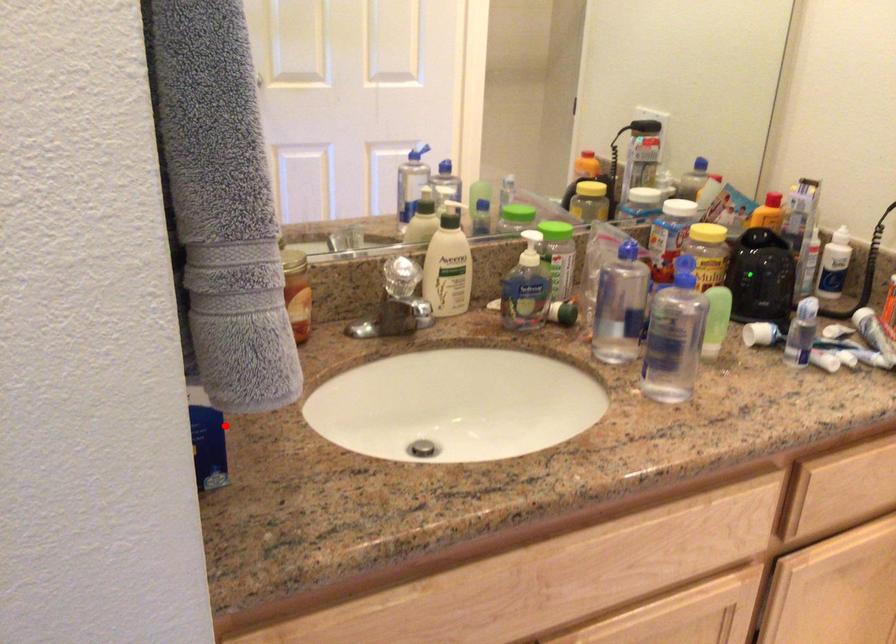
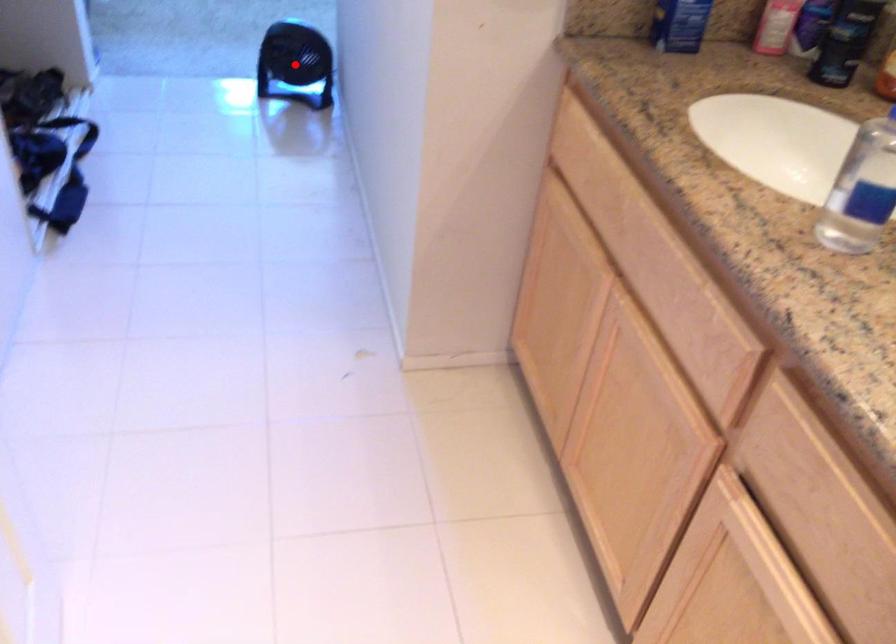
I am providing you with two images of the same scene from different viewpoints. A red point is marked on the first image and another point is marked on the second image. Are the points marked in image1 and image2 representing the same 3D position?

No